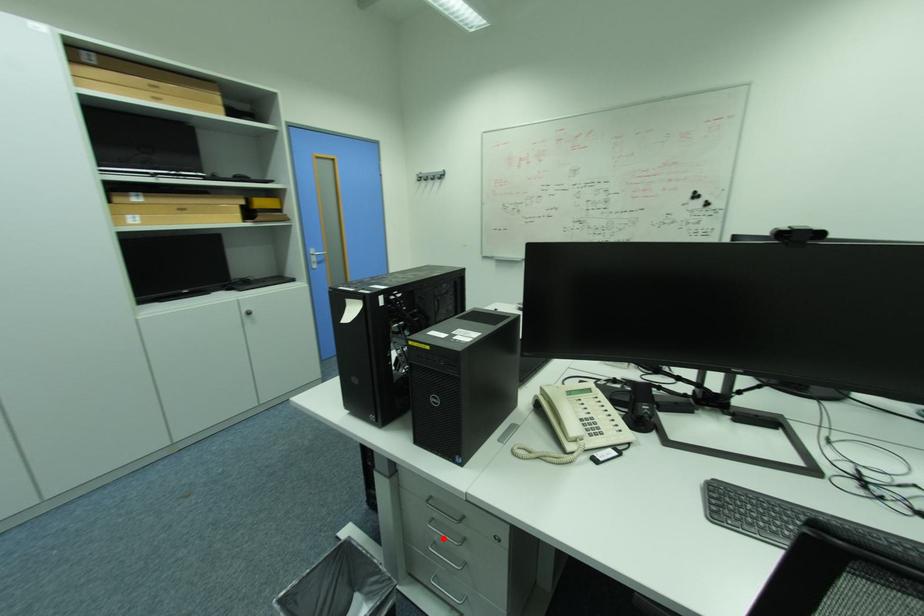
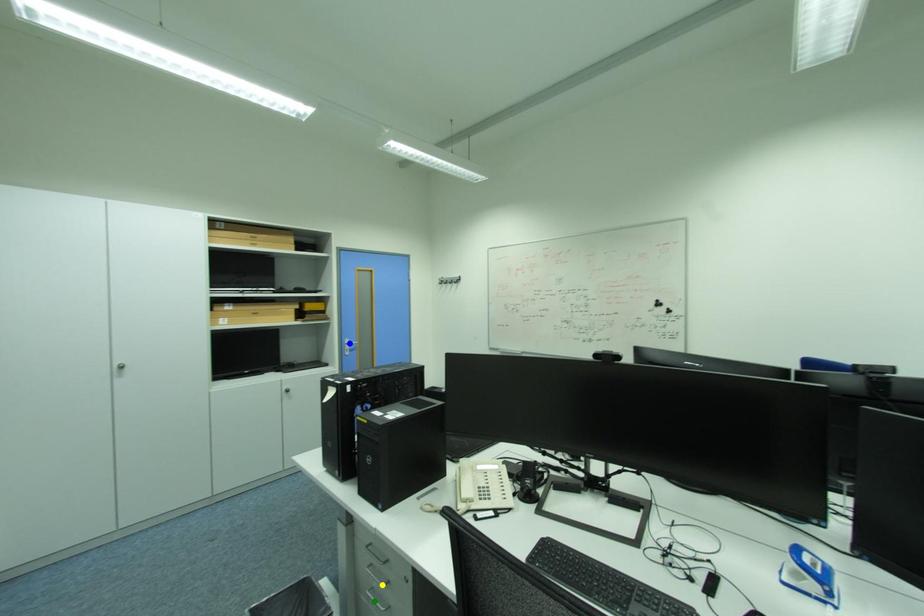
Question: I am providing you with two images of the same scene from different viewpoints. A red point is marked on the first image. You are given multiple points on the second image. Which spot in image 2 lines up with the point in image 1?

Choices:
 (A) yellow point
 (B) green point
 (C) blue point

Answer: (A)